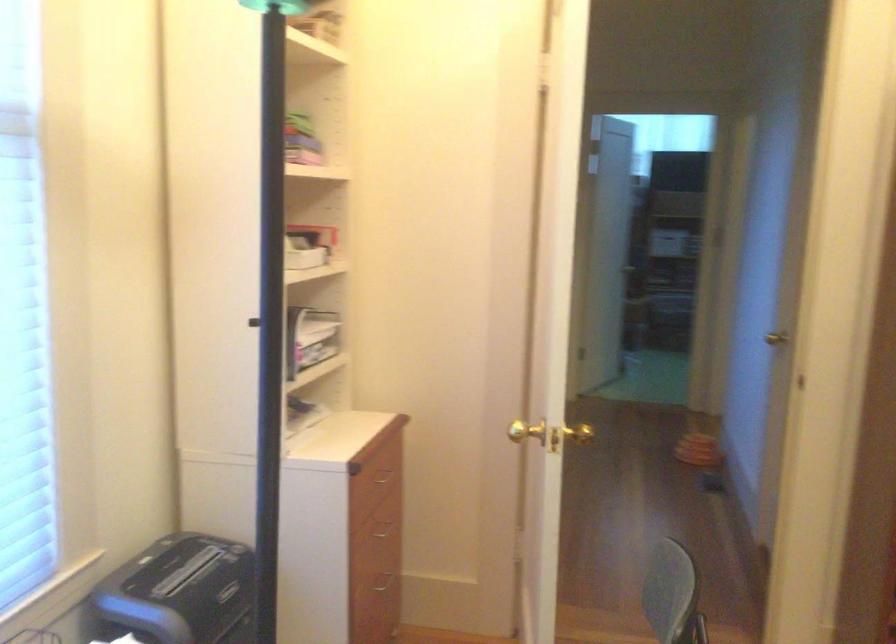
Image resolution: width=896 pixels, height=644 pixels. Identify the location of gold door knob. (x=526, y=431).